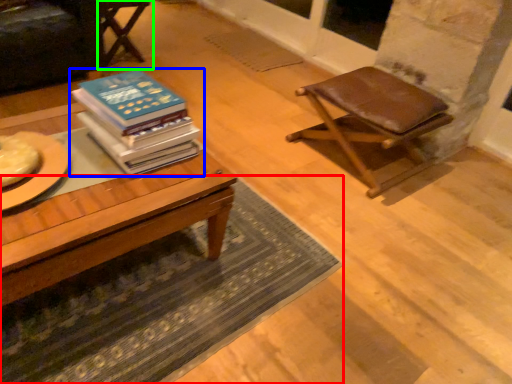
Question: Which object is the farthest from mat (highlighted by a red box)? Choose among these: book (highlighted by a blue box) or chair (highlighted by a green box).

Choices:
 (A) book
 (B) chair

Answer: (B)